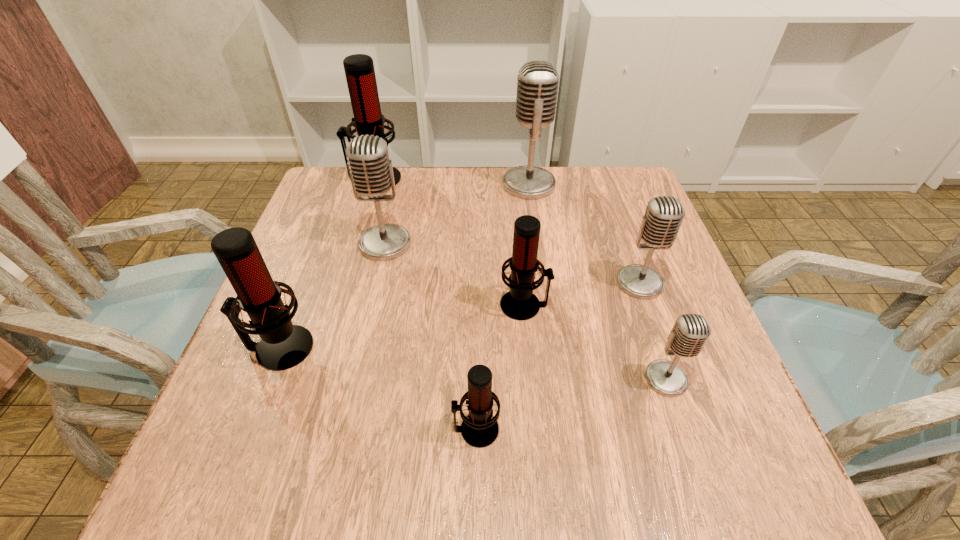
Image resolution: width=960 pixels, height=540 pixels. Find the location of `free space between the farthest red microphone and the third biggest gray microphone`. free space between the farthest red microphone and the third biggest gray microphone is located at coordinates (507, 231).

Find the location of `vacant space that is in between the third farthest object and the third smallest red microphone`. vacant space that is in between the third farthest object and the third smallest red microphone is located at coordinates (332, 296).

Find the location of `free space between the second smallest gray microphone and the nearest red microphone`. free space between the second smallest gray microphone and the nearest red microphone is located at coordinates (558, 356).

You are a GUI agent. You are given a task and a screenshot of the screen. Output one action in this format:
    pyautogui.click(x=<x>, y=<y>)
    Task: Click on the free space between the farthest red microphone and the smallest red microphone
    This screenshot has width=960, height=540.
    Given the screenshot: What is the action you would take?
    pyautogui.click(x=425, y=304)

The width and height of the screenshot is (960, 540). I want to click on empty space that is in between the second nearest gray microphone and the third red microphone from left to right, so click(x=558, y=356).

Image resolution: width=960 pixels, height=540 pixels. What are the coordinates of `the sixth closest object relative to the sixth nearest object` in the screenshot? It's located at (664, 214).

Image resolution: width=960 pixels, height=540 pixels. Find the location of `object that is the sixth closest to the biggest red microphone`. object that is the sixth closest to the biggest red microphone is located at coordinates (479, 429).

You are a GUI agent. You are given a task and a screenshot of the screen. Output one action in this format:
    pyautogui.click(x=<x>, y=<y>)
    Task: Click on the microphone that is the seventh closest to the third biggest gray microphone
    
    Given the screenshot: What is the action you would take?
    pyautogui.click(x=284, y=345)

At what (x,y) coordinates should I click in order to perform the action: click on microphone that stands as the fifth closest to the third smallest red microphone. Please return your answer as a coordinate pair (x, y). Looking at the image, I should click on (537, 84).

Where is `red microphone that can be found as the second closest to the smallest gray microphone`? This screenshot has height=540, width=960. red microphone that can be found as the second closest to the smallest gray microphone is located at coordinates (479, 429).